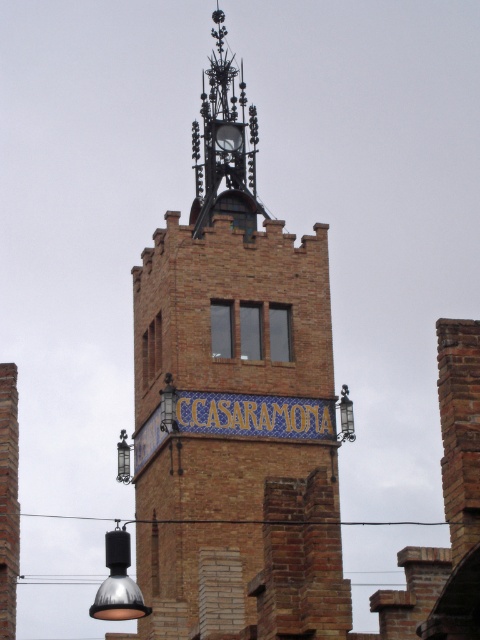
Question: Where is brown brick tower at center located in relation to brick chimney at left in the image?

Choices:
 (A) below
 (B) above

Answer: (B)

Question: Can you confirm if matte black lamp at lower center is wider than matte black lamp at center?

Choices:
 (A) no
 (B) yes

Answer: (B)

Question: Which of the following is the farthest from the observer?

Choices:
 (A) matte black lamp at lower center
 (B) matte black lamp at center
 (C) metallic lantern at center
 (D) metallic glass at center

Answer: (C)

Question: Is brown brick tower at center thinner than metallic glass at center?

Choices:
 (A) no
 (B) yes

Answer: (A)

Question: Among these objects, which one is nearest to the camera?

Choices:
 (A) matte black lamp at center
 (B) brown brick tower at center
 (C) metallic lantern at center

Answer: (B)

Question: Which point is farther from the camera taking this photo?

Choices:
 (A) (144, 611)
 (B) (12, 544)

Answer: (A)